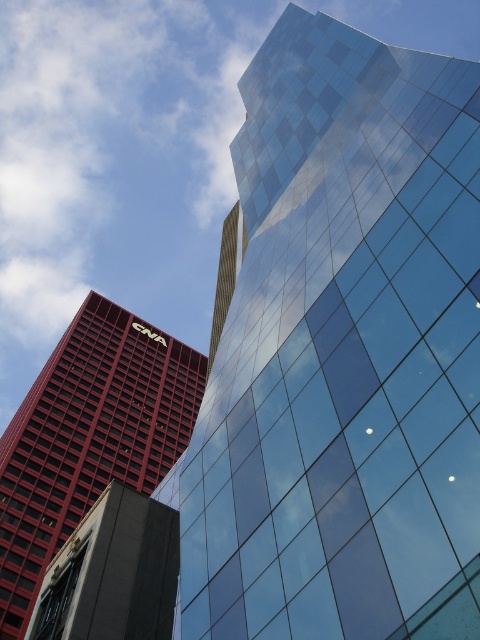
You are standing in front of the two buildings and want to take a photo. You notice two points marked in the scene. The first point is at coordinates point (48, 397) and the second is at point (229, 268). Which point is closer to your camera lens?

Point (48, 397) is further to the camera than point (229, 268), so the point closer to the camera lens is point (229, 268).

You are an architect analyzing the spatial relationship between the transparent glass building at upper right and the gold textured tower at center. Which building has a greater horizontal span from left to right?

The transparent glass building at upper right has a greater horizontal span from left to right than the gold textured tower at center because its width is larger.

You are standing in front of the two buildings and want to determine which point is nearer to you. The first point is at coordinate point (464, 177) and the second is at point (157, 394). Which point is closer to you?

Point (464, 177) is closer to the viewer than point (157, 394).